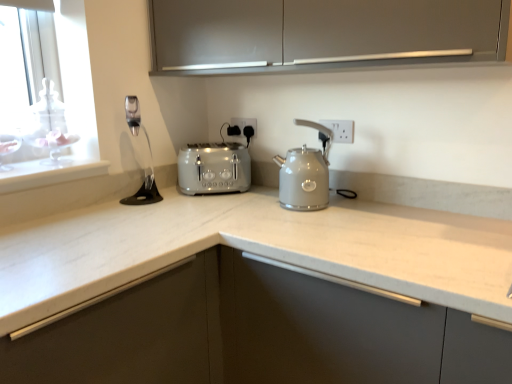
Question: Could you tell me if satin finish cabinet at upper center is facing satin silver toaster at center?

Choices:
 (A) yes
 (B) no

Answer: (B)

Question: Is satin finish cabinet at upper center far from satin silver toaster at center?

Choices:
 (A) no
 (B) yes

Answer: (A)

Question: Can you confirm if satin finish cabinet at upper center is thinner than satin silver toaster at center?

Choices:
 (A) no
 (B) yes

Answer: (A)

Question: Considering the relative sizes of satin finish cabinet at upper center and satin silver toaster at center in the image provided, is satin finish cabinet at upper center bigger than satin silver toaster at center?

Choices:
 (A) yes
 (B) no

Answer: (A)

Question: Can we say satin finish cabinet at upper center lies outside satin silver toaster at center?

Choices:
 (A) yes
 (B) no

Answer: (A)

Question: In the image, is white plastic electric outlet at upper right, positioned as the first electric outlet in front-to-back order, positioned in front of or behind satin silver toaster at center?

Choices:
 (A) front
 (B) behind

Answer: (A)

Question: Based on their positions, is white plastic electric outlet at upper right, positioned as the first electric outlet in front-to-back order, located to the left or right of satin silver toaster at center?

Choices:
 (A) right
 (B) left

Answer: (A)

Question: Choose the correct answer: Is white plastic electric outlet at upper right, positioned as the first electric outlet in front-to-back order, inside satin silver toaster at center or outside it?

Choices:
 (A) outside
 (B) inside

Answer: (A)

Question: Is white plastic electric outlet at upper right, which is the second electric outlet in back-to-front order, wider or thinner than satin silver toaster at center?

Choices:
 (A) thin
 (B) wide

Answer: (A)

Question: Is satin nickel faucet at upper left in front of or behind satin silver toaster at center in the image?

Choices:
 (A) behind
 (B) front

Answer: (A)

Question: In terms of width, does satin nickel faucet at upper left look wider or thinner when compared to satin silver toaster at center?

Choices:
 (A) wide
 (B) thin

Answer: (B)

Question: From the image's perspective, is satin nickel faucet at upper left positioned above or below satin silver toaster at center?

Choices:
 (A) above
 (B) below

Answer: (A)

Question: Is point (135, 99) positioned closer to the camera than point (187, 163)?

Choices:
 (A) closer
 (B) farther

Answer: (B)

Question: Does point (237, 117) appear closer or farther from the camera than point (306, 64)?

Choices:
 (A) farther
 (B) closer

Answer: (A)

Question: From a real-world perspective, relative to satin finish cabinet at upper center, is white plastic electric outlet at upper center, placed as the second electric outlet when sorted from right to left, vertically above or below?

Choices:
 (A) above
 (B) below

Answer: (B)